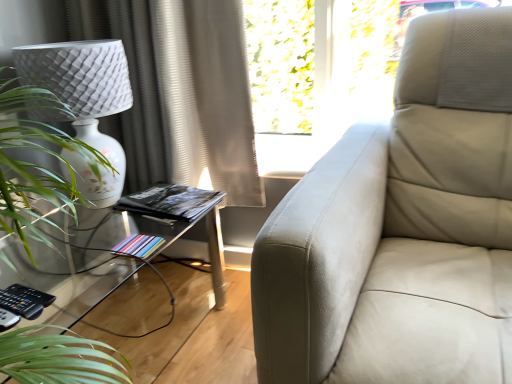
The height and width of the screenshot is (384, 512). Find the location of `black matte book at center, the first book when ordered from back to front`. black matte book at center, the first book when ordered from back to front is located at coordinates (169, 201).

Describe the element at coordinates (189, 230) in the screenshot. I see `clear glass table at lower left` at that location.

This screenshot has width=512, height=384. Describe the element at coordinates (138, 246) in the screenshot. I see `pastel paper book at lower left, marked as the second book in a top-to-bottom arrangement` at that location.

The image size is (512, 384). Describe the element at coordinates (180, 91) in the screenshot. I see `beige textured curtain at upper left` at that location.

You are a GUI agent. You are given a task and a screenshot of the screen. Output one action in this format:
    pyautogui.click(x=<x>, y=<y>)
    Task: Click on the black matte book at center, positioned as the first book in top-to-bottom order
    
    Given the screenshot: What is the action you would take?
    pyautogui.click(x=169, y=201)

Do you think clear glass table at lower left is within pastel paper book at lower left, the 2th book viewed from the back, or outside of it?

clear glass table at lower left is not inside pastel paper book at lower left, the 2th book viewed from the back, it's outside.

Does point (130, 270) appear closer or farther from the camera than point (135, 250)?

Point (130, 270) appears to be farther away from the viewer than point (135, 250).

Which of these two, clear glass table at lower left or pastel paper book at lower left, marked as the second book in a top-to-bottom arrangement, stands taller?

clear glass table at lower left.

Is the surface of clear glass table at lower left in direct contact with pastel paper book at lower left, marked as the second book in a top-to-bottom arrangement?

clear glass table at lower left is not next to pastel paper book at lower left, marked as the second book in a top-to-bottom arrangement, and they're not touching.

Which is behind, point (23, 216) or point (146, 254)?

The point (146, 254) is behind.

From the image's perspective, is green leafy plant at left under pastel paper book at lower left, the 2th book viewed from the back?

Actually, green leafy plant at left appears above pastel paper book at lower left, the 2th book viewed from the back, in the image.

Considering the relative sizes of green leafy plant at left and pastel paper book at lower left, the first book from the bottom, in the image provided, is green leafy plant at left shorter than pastel paper book at lower left, the first book from the bottom,?

No, green leafy plant at left is not shorter than pastel paper book at lower left, the first book from the bottom.

This screenshot has width=512, height=384. I want to click on houseplant above the pastel paper book at lower left, the first book from the bottom (from the image's perspective), so click(34, 163).

Considering the relative positions of black matte book at center, the first book when ordered from back to front, and beige textured curtain at upper left in the image provided, is black matte book at center, the first book when ordered from back to front, to the left of beige textured curtain at upper left from the viewer's perspective?

Incorrect, black matte book at center, the first book when ordered from back to front, is not on the left side of beige textured curtain at upper left.

Is black matte book at center, arranged as the 2th book when viewed from the front, facing away from beige textured curtain at upper left?

black matte book at center, arranged as the 2th book when viewed from the front, is not turned away from beige textured curtain at upper left.

Identify the location of curtain on the left of black matte book at center, arranged as the 2th book when viewed from the front. (180, 91).

Does black matte book at center, arranged as the 2th book when viewed from the front, have a greater height compared to beige textured curtain at upper left?

Incorrect, the height of black matte book at center, arranged as the 2th book when viewed from the front, is not larger of that of beige textured curtain at upper left.

Is pastel paper book at lower left, the first book from the bottom, not close to black matte book at center, arranged as the 2th book when viewed from the front?

No.

Looking at this image, could black matte book at center, the first book when ordered from back to front, be considered to be inside pastel paper book at lower left, the first book from the bottom?

Actually, black matte book at center, the first book when ordered from back to front, is outside pastel paper book at lower left, the first book from the bottom.

From a real-world perspective, which object stands above the other?

black matte book at center, arranged as the 2th book when ordered from the bottom, from a real-world perspective.

Which is correct: pastel paper book at lower left, which appears as the 1th book when viewed from the front, is inside clear glass table at lower left, or outside of it?

pastel paper book at lower left, which appears as the 1th book when viewed from the front, exists entirely within clear glass table at lower left.

Between pastel paper book at lower left, marked as the second book in a top-to-bottom arrangement, and clear glass table at lower left, which one appears on the left side from the viewer's perspective?

From the viewer's perspective, clear glass table at lower left appears more on the left side.

Between pastel paper book at lower left, marked as the second book in a top-to-bottom arrangement, and clear glass table at lower left, which one has more height?

clear glass table at lower left is taller.

Consider the image. Can you confirm if pastel paper book at lower left, marked as the second book in a top-to-bottom arrangement, is thinner than clear glass table at lower left?

Yes.

Locate an element on the screen. the 2nd book behind when counting from the clear glass table at lower left is located at coordinates (169, 201).

Can you confirm if black matte book at center, arranged as the 2th book when viewed from the front, is bigger than clear glass table at lower left?

No.

Is black matte book at center, the first book when ordered from back to front, turned away from clear glass table at lower left?

black matte book at center, the first book when ordered from back to front, is not turned away from clear glass table at lower left.

Which is more to the right, black matte book at center, positioned as the first book in top-to-bottom order, or clear glass table at lower left?

black matte book at center, positioned as the first book in top-to-bottom order.

Does green leafy plant at left have a lesser height compared to beige textured curtain at upper left?

Yes.

Can you confirm if green leafy plant at left is thinner than beige textured curtain at upper left?

In fact, green leafy plant at left might be wider than beige textured curtain at upper left.

From the image's perspective, is green leafy plant at left over beige textured curtain at upper left?

No, from the image's perspective, green leafy plant at left is not over beige textured curtain at upper left.

Is green leafy plant at left placed right next to beige textured curtain at upper left?

green leafy plant at left is not next to beige textured curtain at upper left, and they're not touching.

The height and width of the screenshot is (384, 512). I want to click on the 1st book behind the clear glass table at lower left, so click(x=138, y=246).

Where is `houseplant on the left side of pastel paper book at lower left, which appears as the 1th book when viewed from the front`? houseplant on the left side of pastel paper book at lower left, which appears as the 1th book when viewed from the front is located at coordinates click(x=34, y=163).

In the scene shown: Based on their spatial positions, is clear glass table at lower left or black matte book at center, the first book when ordered from back to front, further from green leafy plant at left?

black matte book at center, the first book when ordered from back to front.

Considering their positions, is green leafy plant at left positioned closer to beige textured curtain at upper left than clear glass table at lower left?

Based on the image, clear glass table at lower left appears to be nearer to beige textured curtain at upper left.

Consider the image. Which object lies nearer to the anchor point green leafy plant at left, beige textured curtain at upper left or pastel paper book at lower left, the first book from the bottom?

The object closer to green leafy plant at left is pastel paper book at lower left, the first book from the bottom.

Considering their positions, is clear glass table at lower left positioned further to pastel paper book at lower left, the first book from the bottom, than green leafy plant at left?

green leafy plant at left is further to pastel paper book at lower left, the first book from the bottom.

Looking at the image, which one is located further to pastel paper book at lower left, the first book from the bottom, beige textured curtain at upper left or clear glass table at lower left?

Among the two, beige textured curtain at upper left is located further to pastel paper book at lower left, the first book from the bottom.

Estimate the real-world distances between objects in this image. Which object is further from beige textured curtain at upper left, pastel paper book at lower left, the first book from the bottom, or black matte book at center, the first book when ordered from back to front?

pastel paper book at lower left, the first book from the bottom, is positioned further to the anchor beige textured curtain at upper left.

Which object lies nearer to the anchor point beige textured curtain at upper left, pastel paper book at lower left, which appears as the 1th book when viewed from the front, or clear glass table at lower left?

The object closer to beige textured curtain at upper left is clear glass table at lower left.

Which object lies nearer to the anchor point clear glass table at lower left, green leafy plant at left or pastel paper book at lower left, which appears as the 1th book when viewed from the front?

The object closer to clear glass table at lower left is pastel paper book at lower left, which appears as the 1th book when viewed from the front.

Locate an element on the screen. book between beige textured curtain at upper left and pastel paper book at lower left, the first book from the bottom, in the up-down direction is located at coordinates (x=169, y=201).

Where is `houseplant that lies between beige textured curtain at upper left and pastel paper book at lower left, which appears as the 1th book when viewed from the front, from top to bottom`? houseplant that lies between beige textured curtain at upper left and pastel paper book at lower left, which appears as the 1th book when viewed from the front, from top to bottom is located at coordinates (34, 163).

Identify the location of houseplant between beige textured curtain at upper left and clear glass table at lower left in the up-down direction. Image resolution: width=512 pixels, height=384 pixels. (34, 163).

In order to click on book between green leafy plant at left and pastel paper book at lower left, the 2th book viewed from the back, in the vertical direction in this screenshot , I will do `click(169, 201)`.